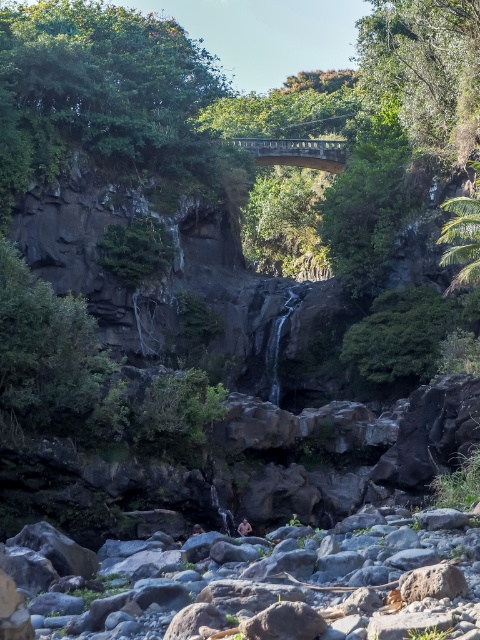
Question: Does green leafy tree at upper left have a greater width compared to green leafy tree at upper center?

Choices:
 (A) yes
 (B) no

Answer: (A)

Question: Which point appears farthest from the camera in this image?

Choices:
 (A) (123, 140)
 (B) (422, 131)

Answer: (A)

Question: Is green leafy tree at upper left further to camera compared to green leafy tree at upper center?

Choices:
 (A) no
 (B) yes

Answer: (B)

Question: Can you confirm if green leafy tree at upper left is smaller than green leafy tree at upper center?

Choices:
 (A) yes
 (B) no

Answer: (B)